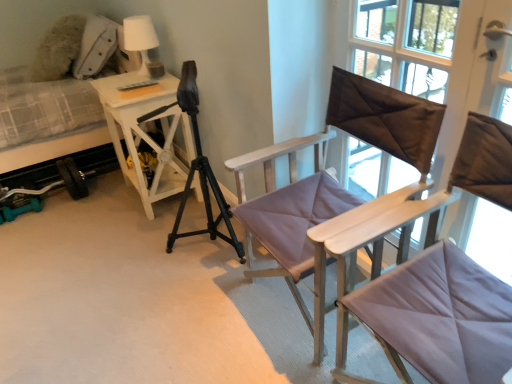
Locate an element on the screen. free space to the left of white wood side table at left is located at coordinates (98, 208).